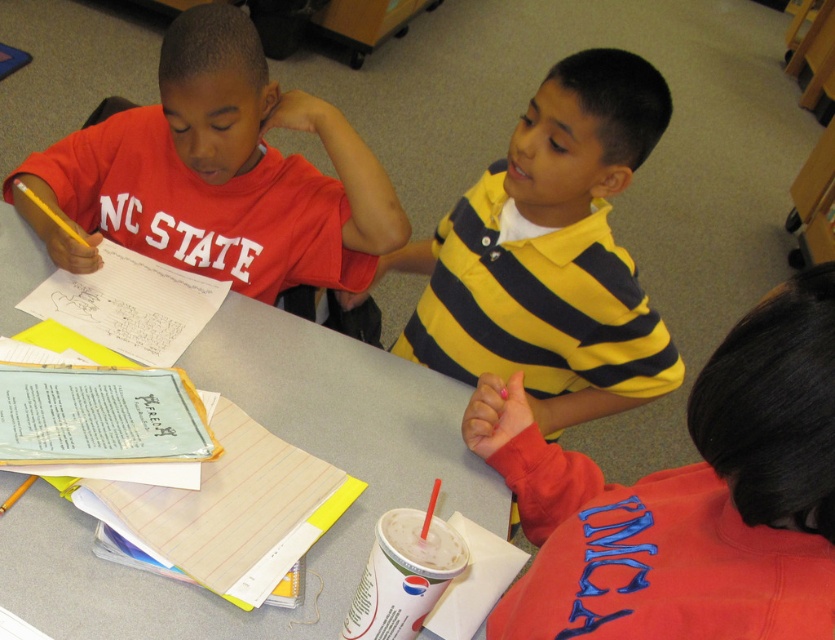
Can you confirm if matte red sweatshirt at lower right is wider than matte red shirt at center?

No.

The image size is (835, 640). Describe the element at coordinates (687, 497) in the screenshot. I see `matte red sweatshirt at lower right` at that location.

What do you see at coordinates (687, 497) in the screenshot?
I see `matte red sweatshirt at lower right` at bounding box center [687, 497].

This screenshot has height=640, width=835. Identify the location of matte red sweatshirt at lower right. (687, 497).

Who is lower down, white paper at upper left or matte red shirt at center?

white paper at upper left

Which of these two, white paper at upper left or matte red shirt at center, stands taller?

matte red shirt at center

This screenshot has height=640, width=835. In order to click on white paper at upper left in this screenshot , I will do `click(286, 442)`.

Locate an element on the screen. white paper at upper left is located at coordinates click(286, 442).

Does white paper at upper left have a lesser height compared to yellow striped polo shirt at center?

Yes, white paper at upper left is shorter than yellow striped polo shirt at center.

Is white paper at upper left further to camera compared to yellow striped polo shirt at center?

No.

Which is behind, point (380, 380) or point (539, 324)?

The point (380, 380) is more distant.

Locate an element on the screen. white paper at upper left is located at coordinates (286, 442).